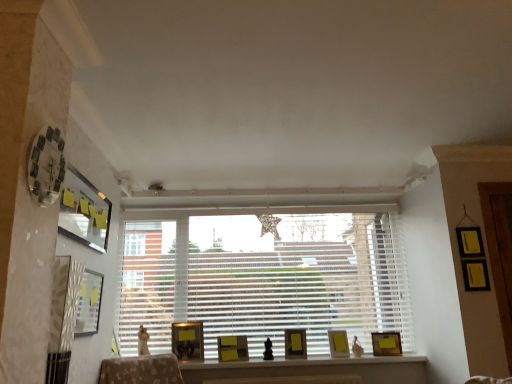
Question: Which direction should I rotate to face matte wooden picture frame at center, which is counted as the 5th picture frame, starting from the right, — up or down?

Choices:
 (A) down
 (B) up

Answer: (A)

Question: Is wooden matte picture frame at center, which appears as the seventh picture frame when viewed from the left, oriented away from matte black picture frame at upper left, the seventh picture frame from the right?

Choices:
 (A) no
 (B) yes

Answer: (A)

Question: Does wooden matte picture frame at center, which appears as the seventh picture frame when viewed from the left, have a lesser height compared to matte black picture frame at upper left, the seventh picture frame from the right?

Choices:
 (A) yes
 (B) no

Answer: (A)

Question: Is wooden matte picture frame at center, positioned as the 1th picture frame in back-to-front order, positioned far away from matte black picture frame at upper left, which ranks as the second picture frame in front-to-back order?

Choices:
 (A) yes
 (B) no

Answer: (A)

Question: Is wooden matte picture frame at center, arranged as the 1th picture frame when viewed from the right, aimed at matte black picture frame at upper left, which ranks as the first picture frame in left-to-right order?

Choices:
 (A) no
 (B) yes

Answer: (A)

Question: Is wooden matte picture frame at center, the 7th picture frame positioned from the front, at the right side of matte black picture frame at upper left, the 6th picture frame when ordered from back to front?

Choices:
 (A) no
 (B) yes

Answer: (B)

Question: Is wooden matte picture frame at center, arranged as the 1th picture frame when viewed from the right, in contact with matte black picture frame at upper left, the 6th picture frame when ordered from back to front?

Choices:
 (A) yes
 (B) no

Answer: (B)

Question: From the image's perspective, is matte yellow picture frame at center, marked as the second picture frame in a right-to-left arrangement, on clear glass clock at upper left, which is the second picture frame in left-to-right order?

Choices:
 (A) no
 (B) yes

Answer: (A)

Question: Could clear glass clock at upper left, which ranks as the 6th picture frame in right-to-left order, be considered to be inside matte yellow picture frame at center, positioned as the second picture frame in back-to-front order?

Choices:
 (A) yes
 (B) no

Answer: (B)

Question: Is matte yellow picture frame at center, marked as the second picture frame in a right-to-left arrangement, facing towards clear glass clock at upper left, which is the second picture frame in left-to-right order?

Choices:
 (A) yes
 (B) no

Answer: (B)

Question: Is matte yellow picture frame at center, the 6th picture frame from the front, smaller than clear glass clock at upper left, which ranks as the 6th picture frame in right-to-left order?

Choices:
 (A) yes
 (B) no

Answer: (B)

Question: From the image's perspective, would you say matte yellow picture frame at center, positioned as the second picture frame in back-to-front order, is shown under clear glass clock at upper left, the 1th picture frame when ordered from front to back?

Choices:
 (A) no
 (B) yes

Answer: (B)

Question: Is clear glass clock at upper left, which ranks as the 6th picture frame in right-to-left order, at the back of matte yellow picture frame at center, the 6th picture frame from the front?

Choices:
 (A) yes
 (B) no

Answer: (B)

Question: Can you confirm if matte wooden picture frame at center, arranged as the 3th picture frame when viewed from the front, is wider than matte yellow picture frame at center, which is the fourth picture frame in back-to-front order?

Choices:
 (A) no
 (B) yes

Answer: (B)